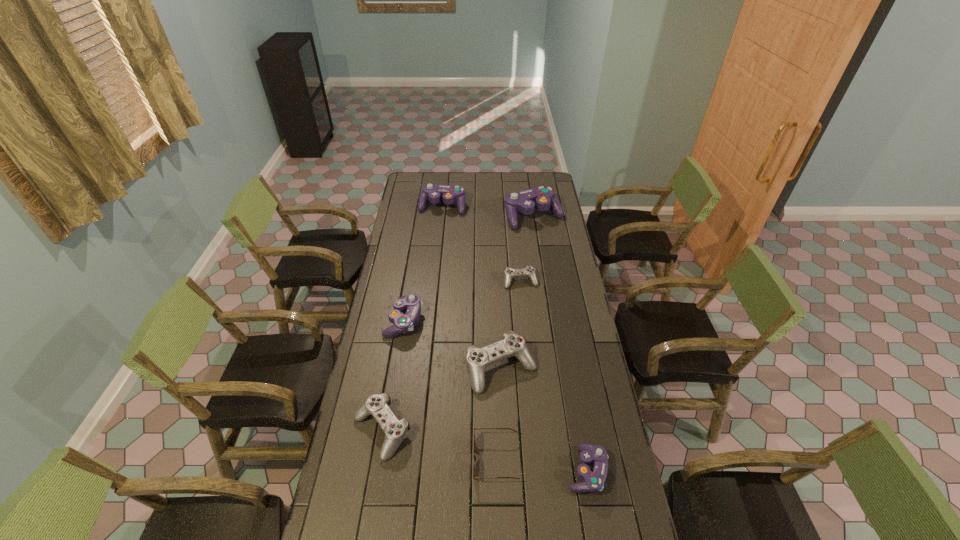
Find the location of a particular element. vacant space that's between the shortest control and the second nearest white control is located at coordinates (511, 325).

Where is `empty space between the smallest white control and the second tallest object`? The width and height of the screenshot is (960, 540). empty space between the smallest white control and the second tallest object is located at coordinates (482, 244).

Locate an element on the screen. Image resolution: width=960 pixels, height=540 pixels. vacant point located between the fifth nearest control and the nearest purple control is located at coordinates (554, 376).

Identify which object is the second closest to the spectacles. Please provide its 2D coordinates. Your answer should be formatted as a tuple, i.e. [(x, y)], where the tuple contains the x and y coordinates of a point satisfying the conditions above.

[(478, 359)]

Identify the location of object that is the nearest to the second tallest object. The height and width of the screenshot is (540, 960). (543, 198).

Where is `the second closest control relative to the smallest purple control`? The width and height of the screenshot is (960, 540). the second closest control relative to the smallest purple control is located at coordinates 395,430.

Identify which control is located as the third nearest to the smallest white control. Please provide its 2D coordinates. Your answer should be formatted as a tuple, i.e. [(x, y)], where the tuple contains the x and y coordinates of a point satisfying the conditions above.

[(402, 323)]

Where is `the closest purple control to the third farthest purple control`? This screenshot has height=540, width=960. the closest purple control to the third farthest purple control is located at coordinates (543, 198).

Identify the location of purple control object that ranks as the closest to the smallest purple control. (402, 323).

Where is `white control that is the closest to the fifth farthest control`? This screenshot has width=960, height=540. white control that is the closest to the fifth farthest control is located at coordinates (395, 430).